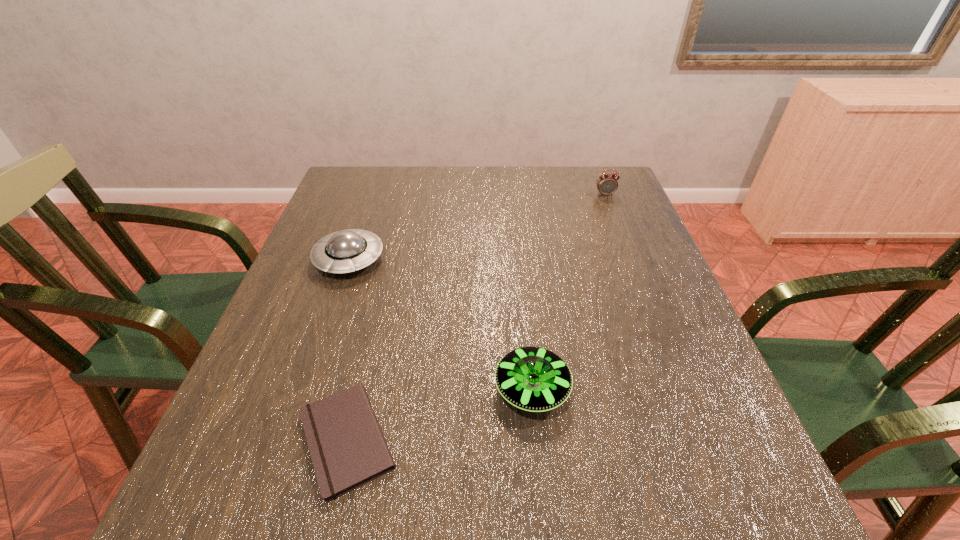
I want to click on the rightmost object, so click(x=607, y=184).

This screenshot has height=540, width=960. Find the location of `alarm clock`. alarm clock is located at coordinates (607, 184).

The image size is (960, 540). I want to click on the farther saucer, so click(345, 251).

Find the location of a particular element. Image resolution: width=960 pixels, height=540 pixels. the second farthest object is located at coordinates (345, 251).

Find the location of a particular element. This screenshot has width=960, height=540. the right saucer is located at coordinates (535, 379).

This screenshot has height=540, width=960. What are the coordinates of `the nearer saucer` in the screenshot? It's located at (535, 379).

The height and width of the screenshot is (540, 960). Identify the location of checkbook. (347, 447).

You are a GUI agent. You are given a task and a screenshot of the screen. Output one action in this format:
    pyautogui.click(x=<x>, y=<y>)
    Task: Click on the free region located 0.280m on the face of the rightmost object
    
    Given the screenshot: What is the action you would take?
    pyautogui.click(x=631, y=258)

Identify the location of free location located 0.230m on the right of the left saucer. coord(477,259).

The height and width of the screenshot is (540, 960). I want to click on vacant space located on the right of the third object from left to right, so click(x=630, y=389).